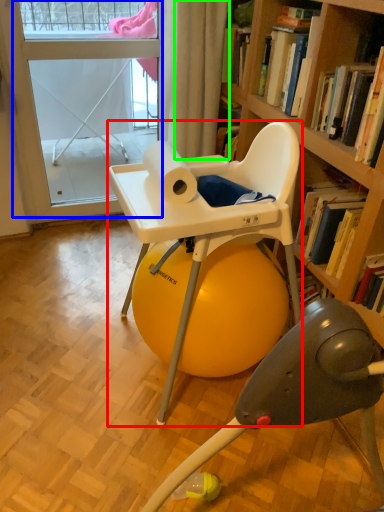
Question: Considering the real-world distances, which object is closest to chair (highlighted by a red box)? screen door (highlighted by a blue box) or curtain (highlighted by a green box).

Choices:
 (A) screen door
 (B) curtain

Answer: (B)